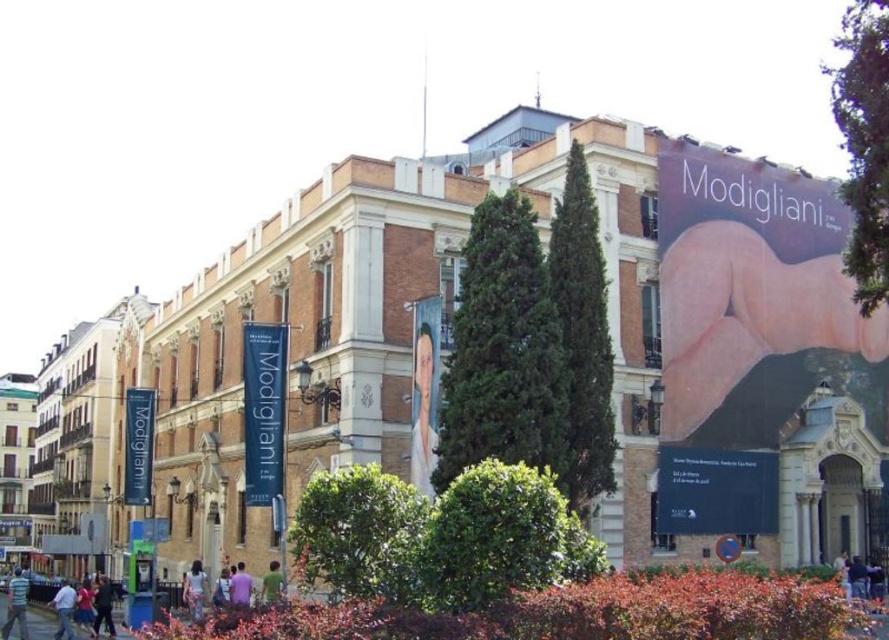
You are an art student analyzing the billboard on the classical building. You notice two clothing items in the artwork on the billboard. The striped cotton shirt at lower left and the light blue jeans at lower left. Which clothing item appears bigger in the artwork?

→ The striped cotton shirt at lower left has a larger size compared to light blue jeans at lower left, so the striped cotton shirt at lower left appears bigger in the artwork.

In the scene shown: You are a fashion designer observing the street scene. You notice two jackets displayed on mannequins. The dark blue jacket at lower left and the light brown leather jacket at lower center. Which jacket is bigger in size?

The light brown leather jacket at lower center is bigger in size compared to the dark blue jacket at lower left.